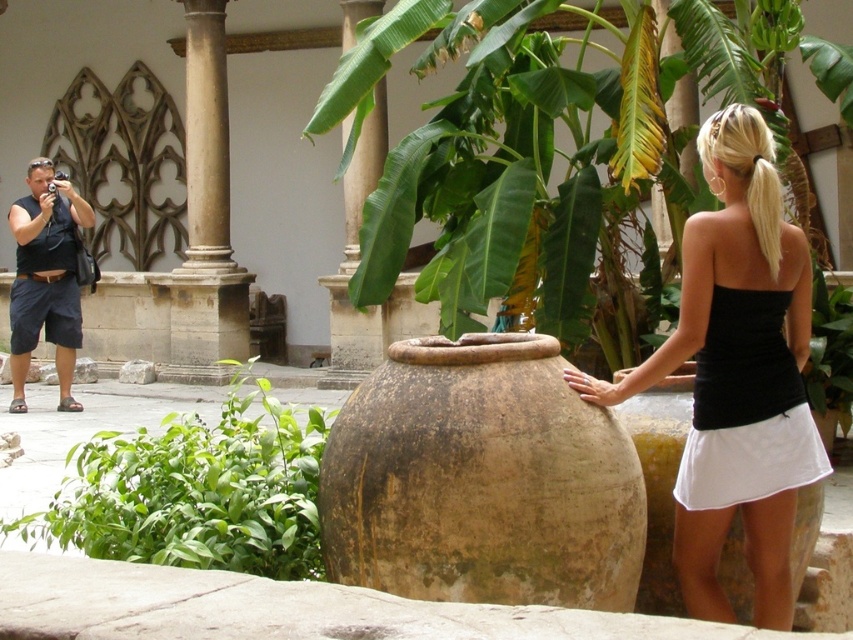
Question: Is brown earthenware vase at center positioned before black matte tank top at center?

Choices:
 (A) yes
 (B) no

Answer: (A)

Question: Which point is closer to the camera?

Choices:
 (A) green leafy plant at left
 (B) beige stone pillar at left
 (C) brown earthenware vase at center
 (D) black matte tank top at left

Answer: (C)

Question: Can you confirm if black matte tank top at center is positioned to the left of green leafy plant at left?

Choices:
 (A) yes
 (B) no

Answer: (B)

Question: Which point is closer to the camera?

Choices:
 (A) (396, 588)
 (B) (209, 458)

Answer: (A)

Question: Which object is closer to the camera taking this photo?

Choices:
 (A) black matte tank top at left
 (B) brown earthenware vase at center

Answer: (B)

Question: Is black matte tank top at center bigger than green leafy plant at left?

Choices:
 (A) yes
 (B) no

Answer: (A)